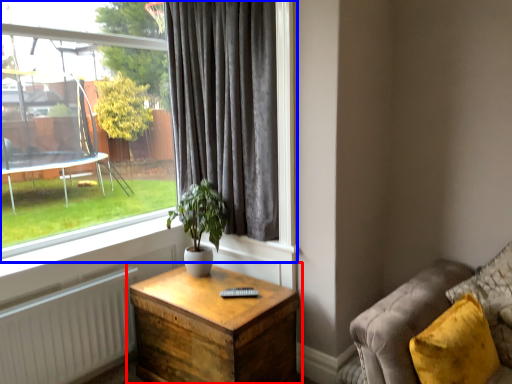
Question: Which of the following is the closest to the observer, nightstand (highlighted by a red box) or window (highlighted by a blue box)?

Choices:
 (A) nightstand
 (B) window

Answer: (A)